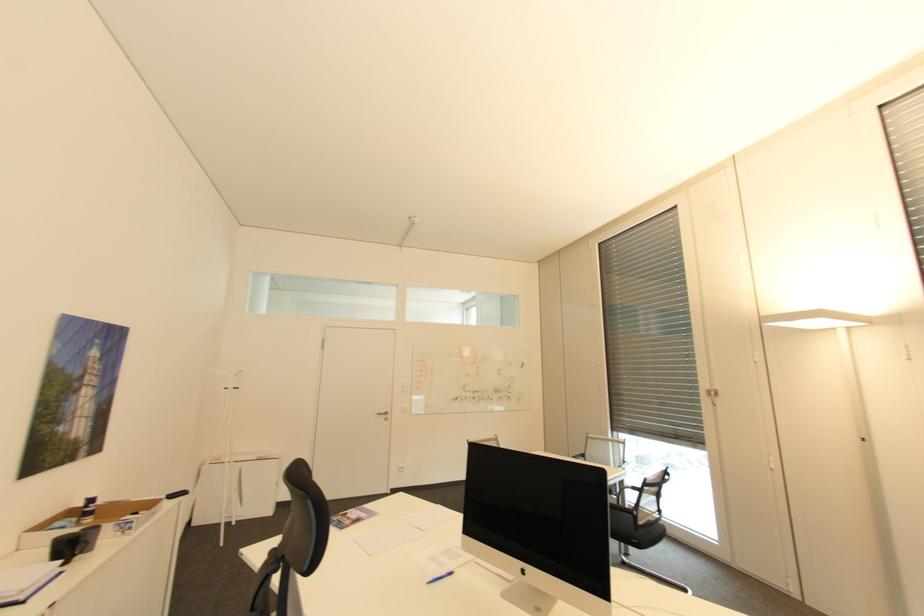
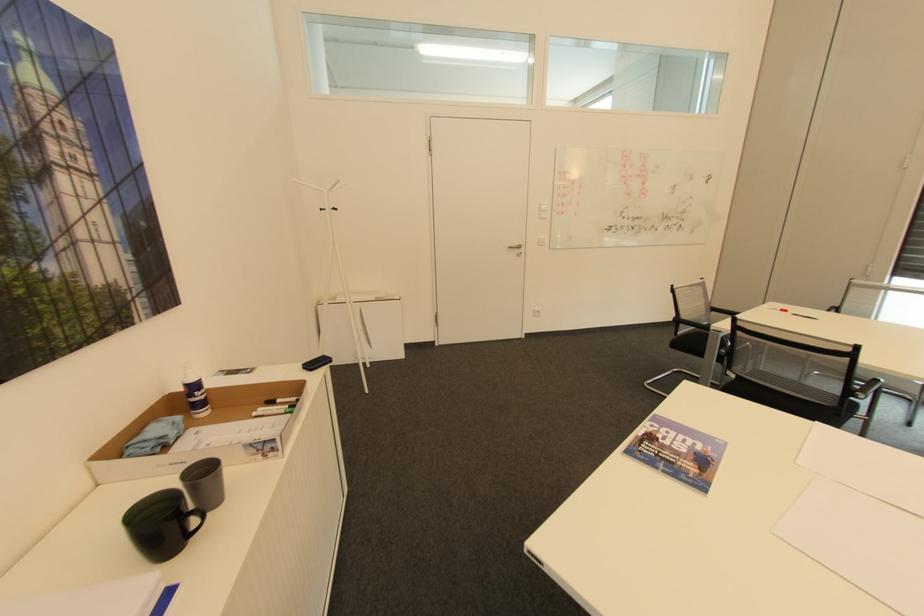
Locate, in the second image, the point that corresponds to pixel 391 413 in the first image.

(524, 246)